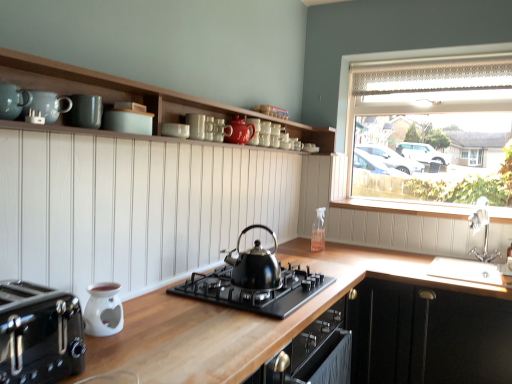
Question: Is clear glass spray bottle at upper right facing towards teal matte mugs at upper center, arranged as the 2th teal when viewed from the front?

Choices:
 (A) yes
 (B) no

Answer: (A)

Question: Is clear glass spray bottle at upper right behind teal matte mugs at upper center, arranged as the 2th teal when viewed from the front?

Choices:
 (A) yes
 (B) no

Answer: (A)

Question: From the image's perspective, would you say clear glass spray bottle at upper right is positioned over teal matte mugs at upper center, arranged as the 2th teal when viewed from the front?

Choices:
 (A) yes
 (B) no

Answer: (B)

Question: Does clear glass spray bottle at upper right have a smaller size compared to teal matte mugs at upper center, arranged as the 2th teal when viewed from the front?

Choices:
 (A) yes
 (B) no

Answer: (B)

Question: Is clear glass spray bottle at upper right closer to the viewer compared to teal matte mugs at upper center, the 1th teal positioned from the back?

Choices:
 (A) no
 (B) yes

Answer: (A)

Question: From a real-world perspective, relative to black plastic toaster at lower left, arranged as the 1th kitchen appliance when viewed from the front, is matte gray mug at upper center, arranged as the second mug when viewed from the right, vertically above or below?

Choices:
 (A) below
 (B) above

Answer: (B)

Question: Considering their positions, is matte gray mug at upper center, which is the first mug from left to right, located in front of or behind black plastic toaster at lower left, arranged as the 1th kitchen appliance when viewed from the front?

Choices:
 (A) front
 (B) behind

Answer: (B)

Question: Considering the positions of matte gray mug at upper center, marked as the 2th mug in a back-to-front arrangement, and black plastic toaster at lower left, arranged as the 1th kitchen appliance when viewed from the front, in the image, is matte gray mug at upper center, marked as the 2th mug in a back-to-front arrangement, wider or thinner than black plastic toaster at lower left, arranged as the 1th kitchen appliance when viewed from the front,?

Choices:
 (A) wide
 (B) thin

Answer: (B)

Question: Is matte gray mug at upper center, which appears as the 1th mug when viewed from the front, bigger or smaller than black plastic toaster at lower left, which appears as the 2th kitchen appliance when viewed from the back?

Choices:
 (A) small
 (B) big

Answer: (A)

Question: Is point (47, 294) closer or farther from the camera than point (98, 311)?

Choices:
 (A) farther
 (B) closer

Answer: (B)

Question: Choose the correct answer: Is black plastic toaster at lower left, arranged as the 1th kitchen appliance when viewed from the front, inside white ceramic oil burner at lower left, the first kitchen appliance viewed from the back, or outside it?

Choices:
 (A) inside
 (B) outside

Answer: (B)

Question: Considering the positions of black plastic toaster at lower left, arranged as the 1th kitchen appliance when viewed from the front, and white ceramic oil burner at lower left, the first kitchen appliance viewed from the back, in the image, is black plastic toaster at lower left, arranged as the 1th kitchen appliance when viewed from the front, wider or thinner than white ceramic oil burner at lower left, the first kitchen appliance viewed from the back,?

Choices:
 (A) wide
 (B) thin

Answer: (A)

Question: In terms of height, does black plastic toaster at lower left, which appears as the 2th kitchen appliance when viewed from the back, look taller or shorter compared to white ceramic oil burner at lower left, which appears as the 2th kitchen appliance when viewed from the front?

Choices:
 (A) short
 (B) tall

Answer: (B)

Question: From the image's perspective, is clear glass spray bottle at upper right positioned above or below black matte gas stove at center?

Choices:
 (A) below
 (B) above

Answer: (B)

Question: Considering the positions of clear glass spray bottle at upper right and black matte gas stove at center in the image, is clear glass spray bottle at upper right taller or shorter than black matte gas stove at center?

Choices:
 (A) short
 (B) tall

Answer: (B)